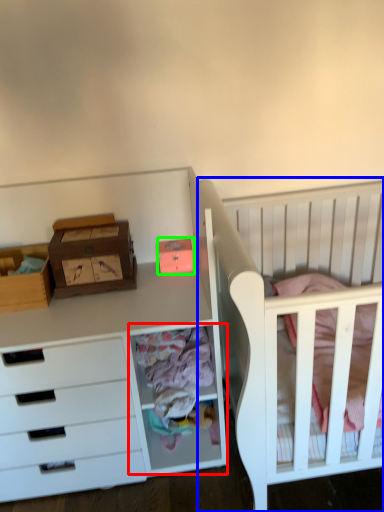
Question: Based on their relative distances, which object is nearer to cabinet (highlighted by a red box)? Choose from infant bed (highlighted by a blue box) and storage box (highlighted by a green box).

Choices:
 (A) infant bed
 (B) storage box

Answer: (A)